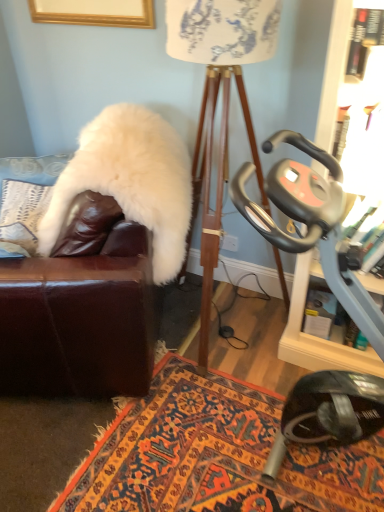
This screenshot has width=384, height=512. Find the location of `empty space that is ontop of carpeted rug at center (from a real-world perspective)`. empty space that is ontop of carpeted rug at center (from a real-world perspective) is located at coordinates (175, 423).